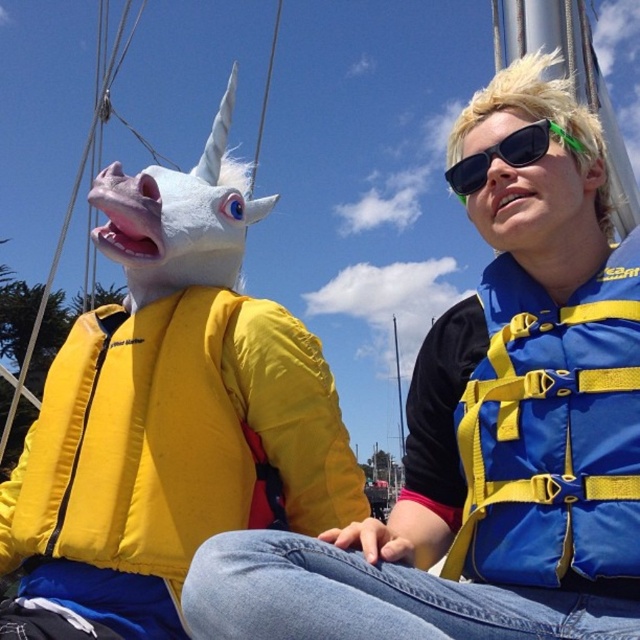
You are a lifeguard who needs to choose a life jacket for a child. The child is 4 feet tall and weighs 50 pounds. You have two options in the image. Which life jacket, the yellow foam life jacket at left or the blue fabric life jacket at right, would you recommend based on their sizes?

The yellow foam life jacket at left has a larger width than the blue fabric life jacket at right, so it would be more suitable for a child who is 4 feet tall and weighs 50 pounds as it provides better buoyancy and support.

You are a photographer trying to capture the blue fabric life jacket at right in your shot. According to the coordinates provided, where should you position your camera to ensure the jacket is centered in the frame?

The blue fabric life jacket at right is located at point 0.673 on the x axis and 0.863 on the y axis, so you should position your camera to center the frame at those coordinates to capture it.